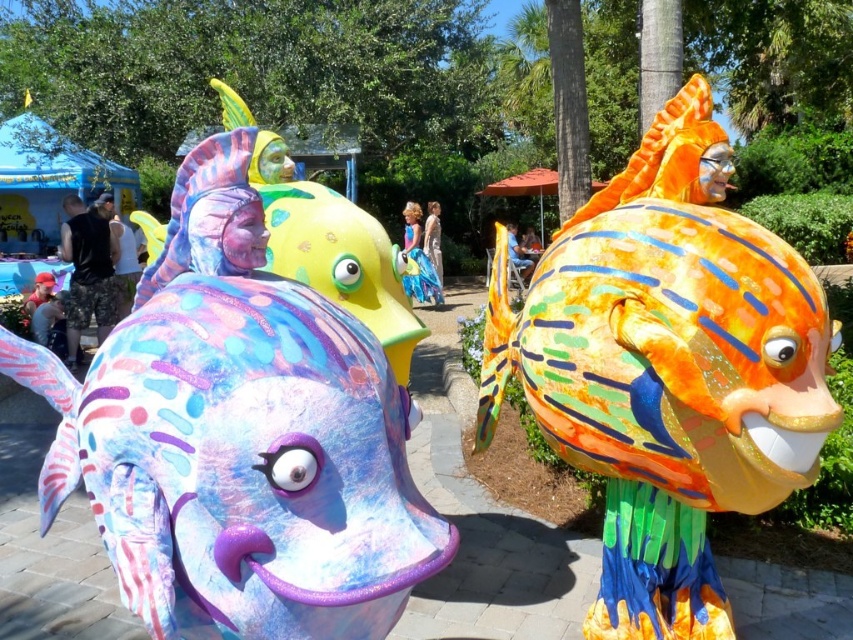
Is pastel painted fish at center shorter than shiny orange fish at center?

Correct, pastel painted fish at center is not as tall as shiny orange fish at center.

Is pastel painted fish at center taller than shiny orange fish at center?

In fact, pastel painted fish at center may be shorter than shiny orange fish at center.

Who is more distant from viewer, [395,465] or [709,346]?

The point [709,346] is behind.

The image size is (853, 640). Identify the location of pastel painted fish at center. (241, 464).